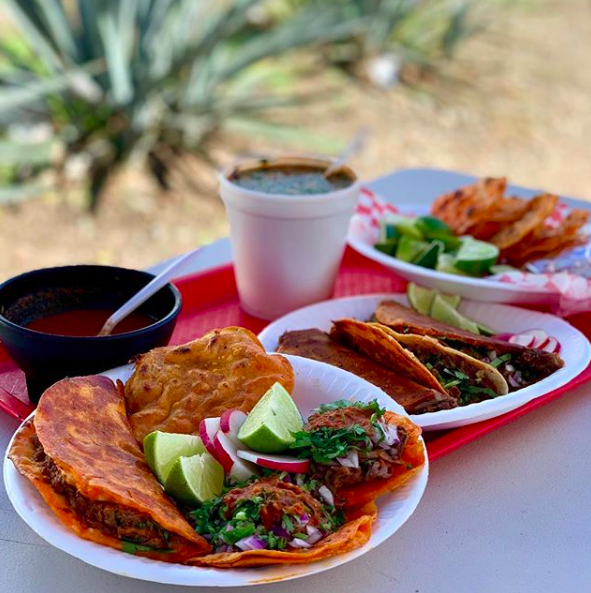
In order to click on table in this screenshot , I will do (525, 519).